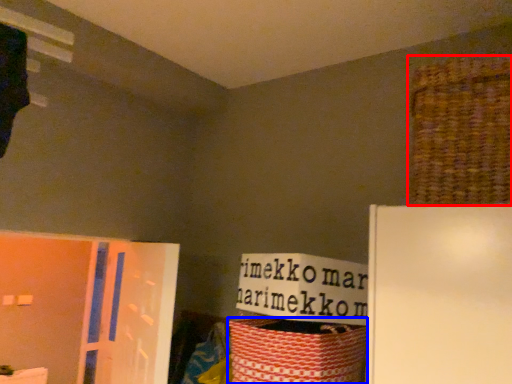
Question: Which object appears farthest to the camera in this image, basket (highlighted by a red box) or basket (highlighted by a blue box)?

Choices:
 (A) basket
 (B) basket

Answer: (B)